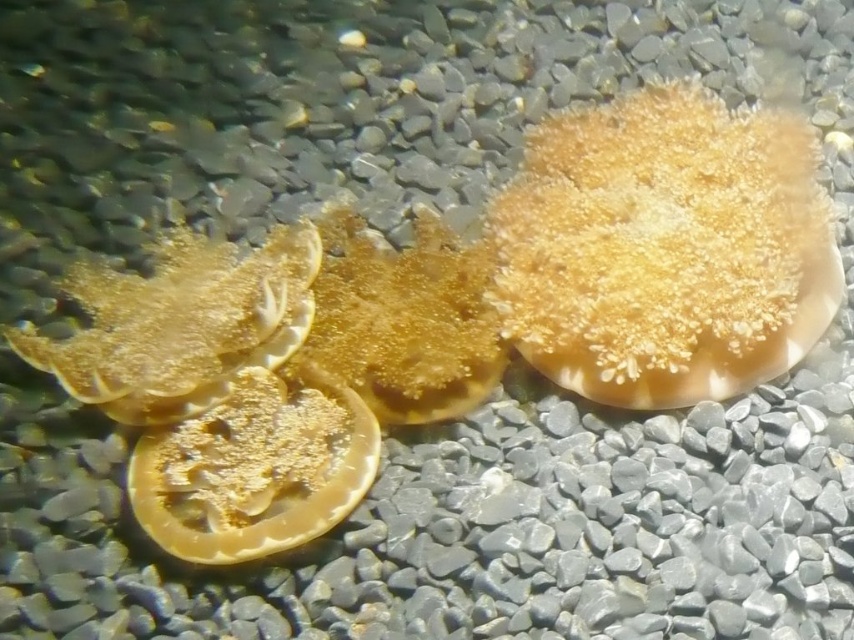
You are an underwater explorer looking at the golden textured scallop at center and the translucent yellow scallop at center. Which one is closer to you?

The golden textured scallop at center is closer to you than the translucent yellow scallop at center.

You are an aquatic biologist examining two scallops in an aquarium. You have a measuring tool that can only fit objects narrower than 5 cm. The golden textured scallop at center and the translucent yellow scallop at center are both in your view. Which scallop can you measure with your tool?

The translucent yellow scallop at center can be measured with the tool since its width is narrower than the golden textured scallop at center, which is under the 5 cm limit.